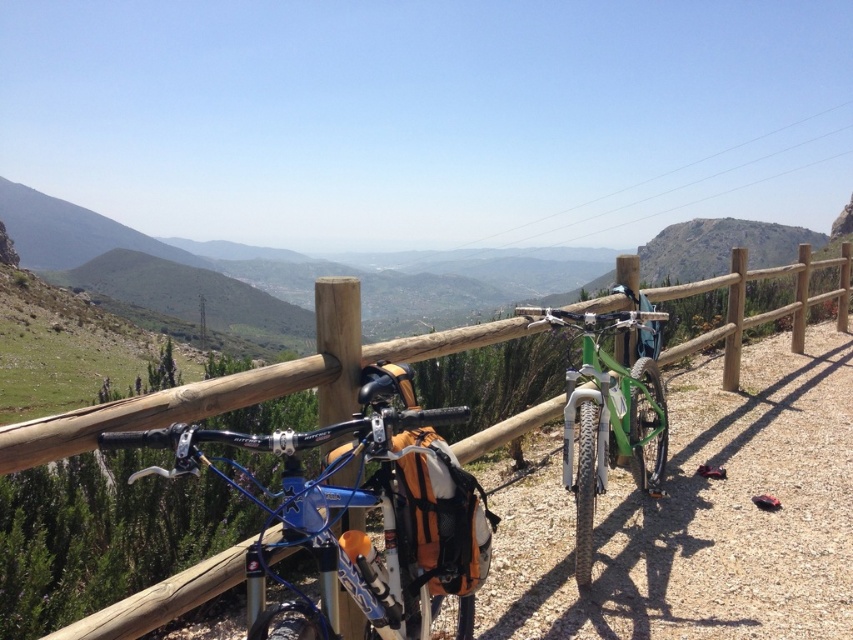
You are a hiker who wants to take a photo of the wooden fence at center from the path. Since the green matte bicycle at center is blocking the view, can you move it to the side to get an unobstructed shot?

The wooden fence at center is behind the green matte bicycle at center, so the bicycle is in front of the fence. Moving the bicycle to the side would allow you to take an unobstructed photo of the wooden fence at center.

You are a hiker who wants to take a photo of the blue metallic bicycle at center and the wooden fence at center. Since you have a camera with a fixed focal length, you need to adjust your distance to ensure both objects are in focus. Which object should you move closer to or farther from to achieve this?

The blue metallic bicycle at center is bigger than the wooden fence at center. To ensure both are in focus, you should move closer to the blue metallic bicycle at center so that the larger object fills the frame appropriately while keeping the wooden fence at center in the background within the depth of field.

You are a hiker who wants to move from the green matte bicycle at center to the wooden fence at center. Can you walk directly between them without any obstacles?

The green matte bicycle at center and wooden fence at center are 6.32 feet apart, so yes, you can walk directly between them without any obstacles since there is enough space between them.